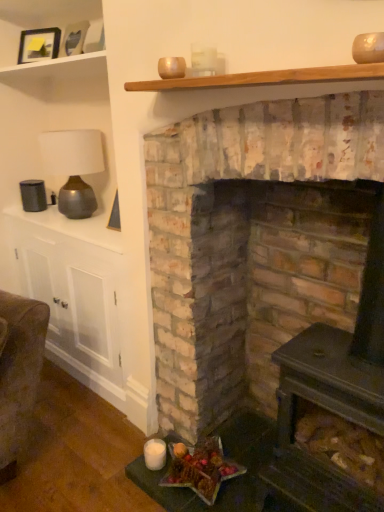
Question: Does wooden plank at upper center, which appears as the 1th shelf when viewed from the front, appear on the left side of wooden picture frame at upper left, acting as the first picture frame starting from the front?

Choices:
 (A) yes
 (B) no

Answer: (B)

Question: Is wooden plank at upper center, the second shelf when ordered from back to front, bigger than wooden picture frame at upper left, acting as the first picture frame starting from the front?

Choices:
 (A) no
 (B) yes

Answer: (B)

Question: Is wooden plank at upper center, which is the second shelf in top-to-bottom order, at the right side of wooden picture frame at upper left, the 1th picture frame viewed from the right?

Choices:
 (A) yes
 (B) no

Answer: (A)

Question: Is wooden plank at upper center, which appears as the 1th shelf when viewed from the front, outside wooden picture frame at upper left, which is the second picture frame in left-to-right order?

Choices:
 (A) no
 (B) yes

Answer: (B)

Question: Is wooden plank at upper center, the second shelf when ordered from back to front, facing away from wooden picture frame at upper left, acting as the first picture frame starting from the front?

Choices:
 (A) yes
 (B) no

Answer: (B)

Question: Is point (94, 161) positioned closer to the camera than point (18, 28)?

Choices:
 (A) closer
 (B) farther

Answer: (A)

Question: Considering the positions of matte brown lamp at upper left and wooden shelf at upper left, the 2th shelf when ordered from front to back, in the image, is matte brown lamp at upper left bigger or smaller than wooden shelf at upper left, the 2th shelf when ordered from front to back,?

Choices:
 (A) small
 (B) big

Answer: (A)

Question: In terms of width, does matte brown lamp at upper left look wider or thinner when compared to wooden shelf at upper left, marked as the first shelf in a left-to-right arrangement?

Choices:
 (A) wide
 (B) thin

Answer: (A)

Question: Do you think matte brown lamp at upper left is within wooden shelf at upper left, the 2th shelf when ordered from front to back, or outside of it?

Choices:
 (A) inside
 (B) outside

Answer: (B)

Question: From the image's perspective, relative to wooden plank at upper center, which is the 2th shelf from left to right, is shiny metallic star at lower center above or below?

Choices:
 (A) below
 (B) above

Answer: (A)

Question: In terms of size, does shiny metallic star at lower center appear bigger or smaller than wooden plank at upper center, which is the 2th shelf from left to right?

Choices:
 (A) small
 (B) big

Answer: (B)

Question: Is shiny metallic star at lower center to the left or to the right of wooden plank at upper center, positioned as the 1th shelf in bottom-to-top order, in the image?

Choices:
 (A) right
 (B) left

Answer: (B)

Question: Is shiny metallic star at lower center inside the boundaries of wooden plank at upper center, which appears as the 1th shelf when viewed from the front, or outside?

Choices:
 (A) inside
 (B) outside

Answer: (B)

Question: Is matte black picture frame at upper left, the 1th picture frame viewed from the back, situated inside wooden picture frame at upper left, the 2th picture frame from the back, or outside?

Choices:
 (A) outside
 (B) inside

Answer: (A)

Question: Considering the positions of matte black picture frame at upper left, the second picture frame when ordered from front to back, and wooden picture frame at upper left, the 2th picture frame from the back, in the image, is matte black picture frame at upper left, the second picture frame when ordered from front to back, wider or thinner than wooden picture frame at upper left, the 2th picture frame from the back,?

Choices:
 (A) thin
 (B) wide

Answer: (A)